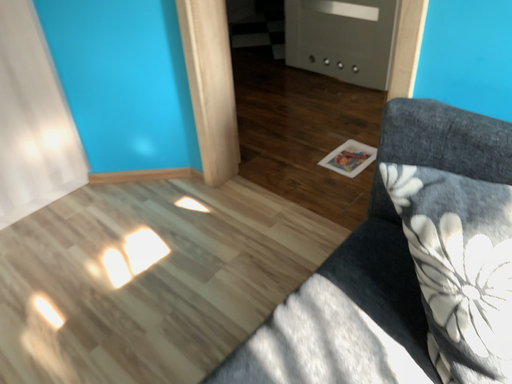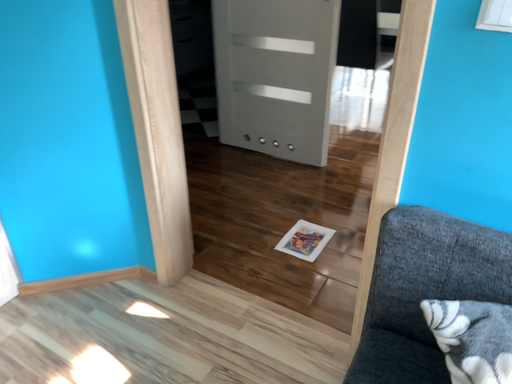
Question: Which way did the camera rotate in the video?

Choices:
 (A) rotated left
 (B) rotated right

Answer: (B)